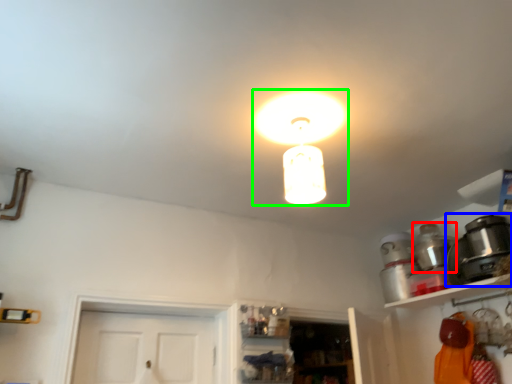
Question: Based on their relative distances, which object is farther from appliance (highlighted by a red box)? Choose from appliance (highlighted by a blue box) and lamp (highlighted by a green box).

Choices:
 (A) appliance
 (B) lamp

Answer: (B)